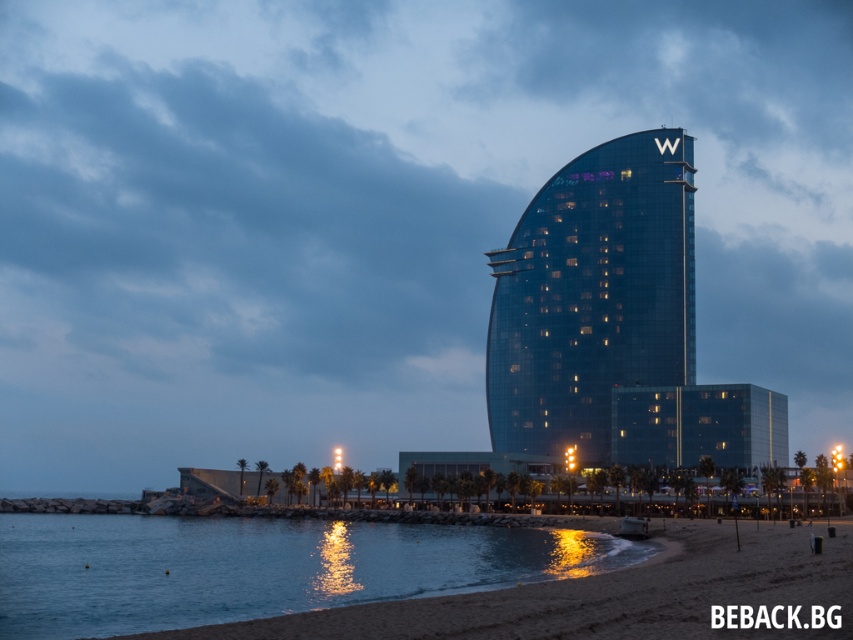
You are standing at the center of the beach in front of the W Hotel landmark. You want to take a photo of the W Hotel logo at the top of the building while avoiding any reflections from the blue glassy water at lower left. Where should you position yourself to ensure the logo is clearly visible without the water reflecting in the shot?

You should position yourself away from the blue glassy water at lower left, which is located at point (260, 566). Since reflections are strongest near the water surface, moving to higher ground or angling your camera upward will minimize the reflection and allow the W Hotel logo to be clearly visible.

Looking at this image, you are a photographer planning to capture the transparent glass tower at center and the blue glassy water at lower left in a single frame. Based on their sizes in the image, which object would occupy more of the horizontal space in your photo?

The blue glassy water at lower left has a larger width than the transparent glass tower at center, so it would occupy more horizontal space in the photo.